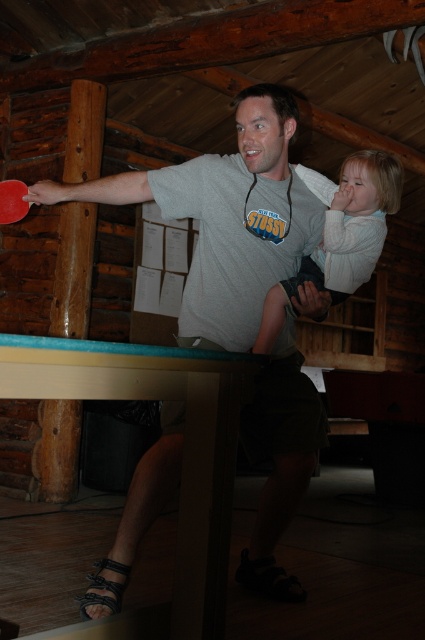
You are a photographer trying to capture the man and the child in the scene. The man is wearing a matte gray t shirt. Where should you focus your camera to ensure the matte gray t shirt at center is in sharp focus? Please provide the coordinates in the format of a point like point (226, 218).

The coordinates for the matte gray t shirt at center are point (226, 218), so you should focus your camera at point (226, 218) to ensure sharp focus.